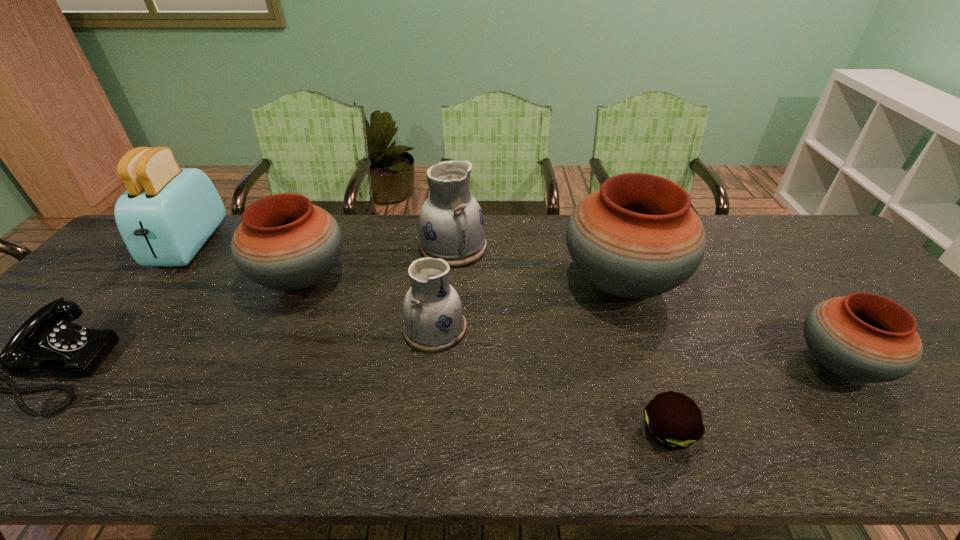
I want to click on vacant area situated 0.250m on the side of the light toaster with the lever, so click(108, 342).

The image size is (960, 540). In order to click on vacant space located 0.350m on the front of the second red pottery from right to left in this screenshot , I will do `click(685, 461)`.

Locate an element on the screen. This screenshot has height=540, width=960. vacant space located 0.110m on the right of the farther blue pottery is located at coordinates (522, 246).

The height and width of the screenshot is (540, 960). I want to click on free space located 0.180m on the front of the leftmost red pottery, so click(259, 369).

Identify the location of free space located 0.220m on the right of the nearer blue pottery. The height and width of the screenshot is (540, 960). (554, 328).

I want to click on vacant space located 0.300m on the left of the shortest pottery, so click(x=665, y=364).

Where is `free spot located 0.370m on the back of the shortest object`? This screenshot has width=960, height=540. free spot located 0.370m on the back of the shortest object is located at coordinates 618,291.

Where is `toaster that is at the far edge`? This screenshot has height=540, width=960. toaster that is at the far edge is located at coordinates (167, 213).

You are a GUI agent. You are given a task and a screenshot of the screen. Output one action in this format:
    pyautogui.click(x=<x>, y=<y>)
    Task: Click on the object situated at the near edge
    The image size is (960, 540).
    Given the screenshot: What is the action you would take?
    pyautogui.click(x=674, y=421)

Image resolution: width=960 pixels, height=540 pixels. I want to click on object situated at the left edge, so click(167, 213).